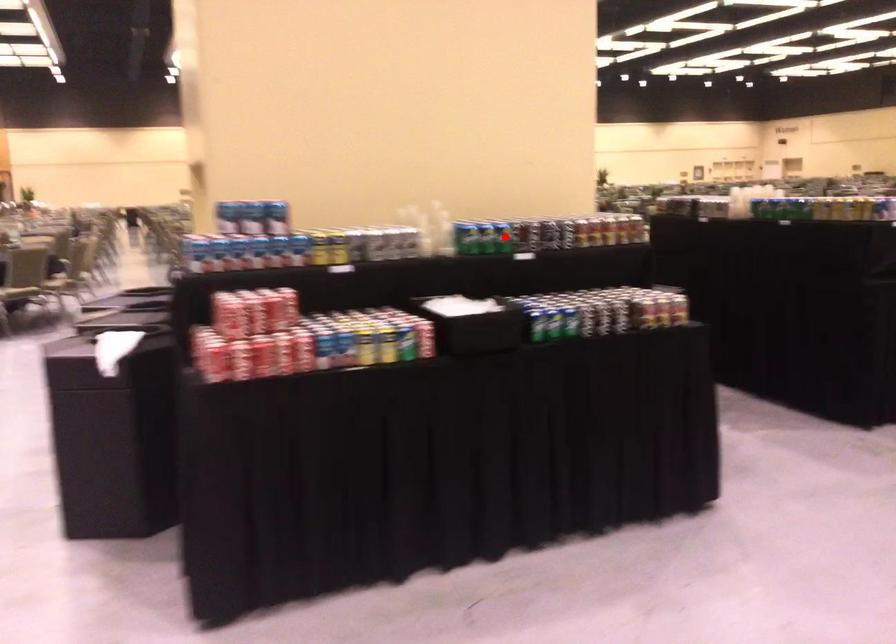
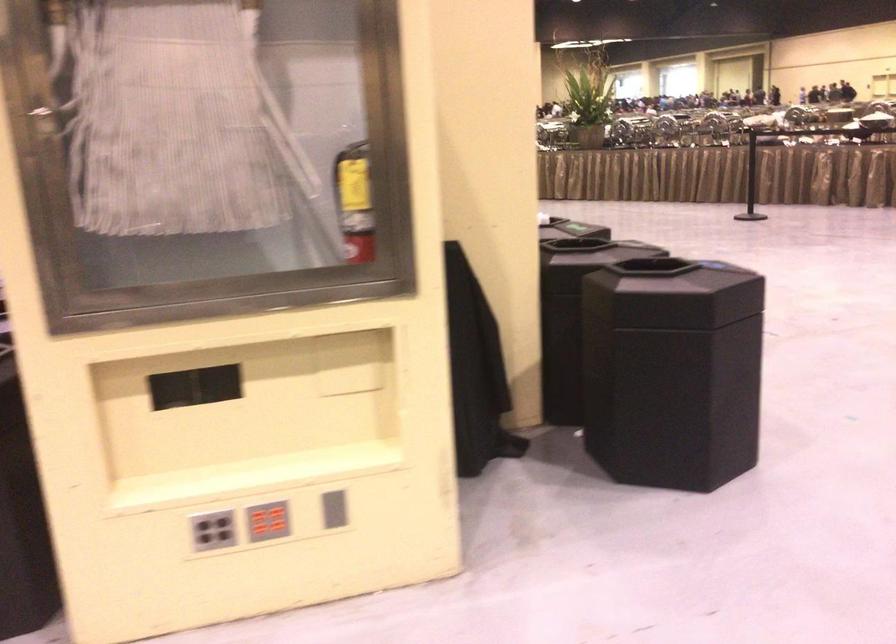
Question: I am providing you with two images of the same scene from different viewpoints. A red point is marked on the first image. Is the red point's position out of view in image 2?

Choices:
 (A) Yes
 (B) No

Answer: (A)